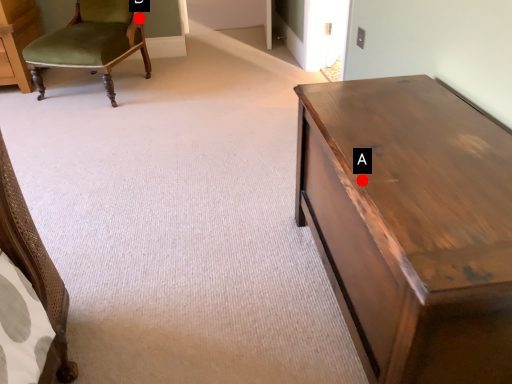
Question: Two points are circled on the image, labeled by A and B beside each circle. Which point is farther to the camera?

Choices:
 (A) A is further
 (B) B is further

Answer: (B)